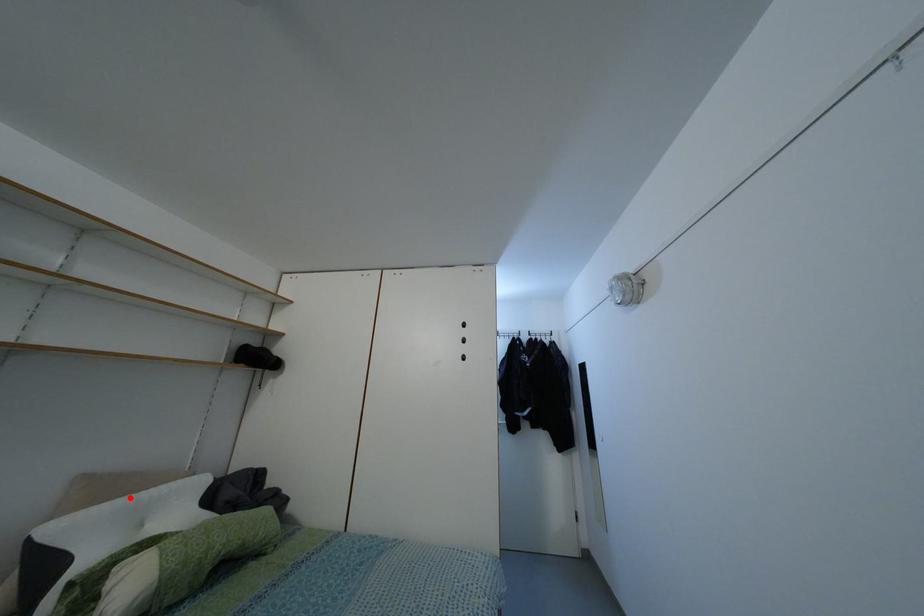
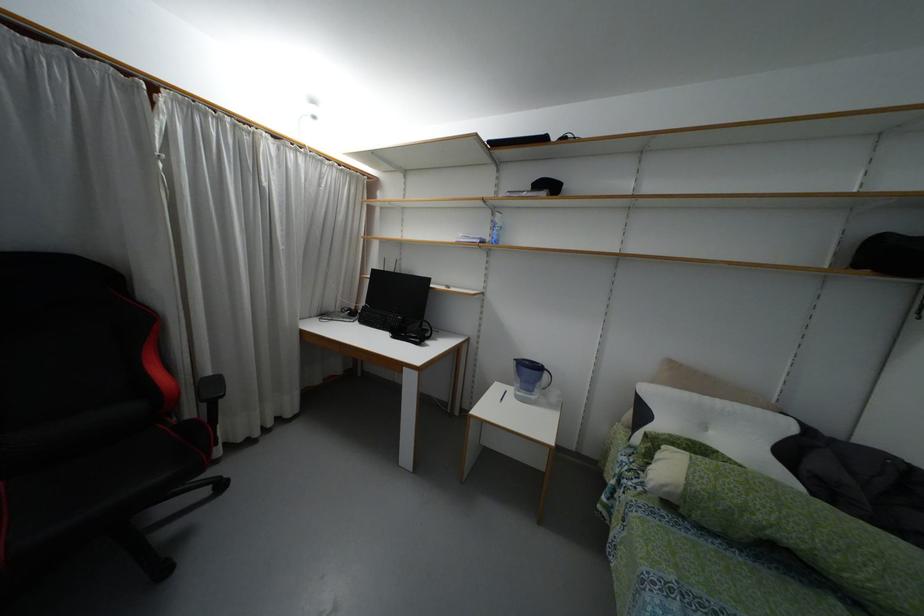
Find the pixel in the second image that matches the highlighted location in the first image.

(695, 395)